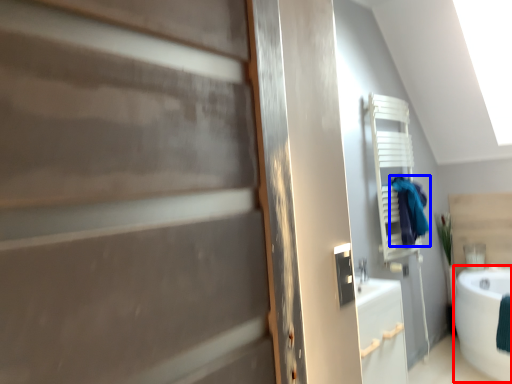
Question: Which of the following is the farthest to the observer, bath (highlighted by a red box) or laundry (highlighted by a blue box)?

Choices:
 (A) bath
 (B) laundry

Answer: (B)